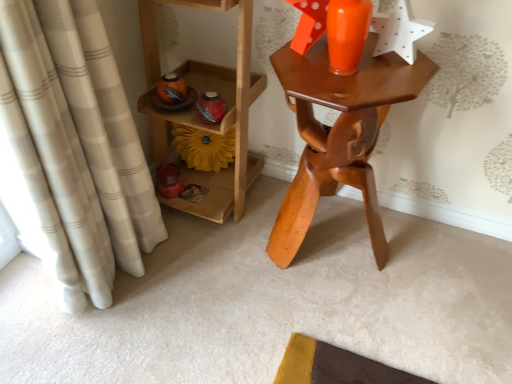
Image resolution: width=512 pixels, height=384 pixels. In order to click on vacant space to the right of beige plaid curtain at left in this screenshot , I will do `click(214, 281)`.